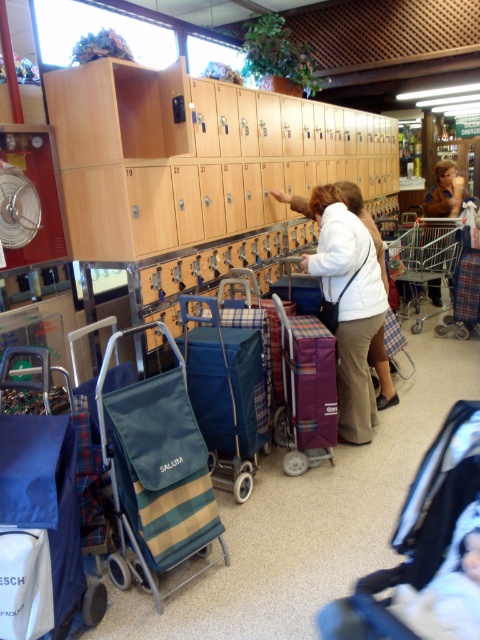
Can you confirm if dark blue fabric baby carriage at lower right is thinner than green striped fabric trolley at center?

Yes.

Is the position of dark blue fabric baby carriage at lower right more distant than that of green striped fabric trolley at center?

No.

Is point (393, 580) farther from camera compared to point (122, 566)?

No, it is in front of (122, 566).

The image size is (480, 640). In order to click on dark blue fabric baby carriage at lower right in this screenshot , I will do `click(427, 550)`.

Which is above, dark blue fabric baby carriage at lower right or brown plaid skirt at center?

brown plaid skirt at center is higher up.

Is point (448, 632) more distant than point (432, 280)?

No, (448, 632) is closer to viewer.

Which is in front, point (444, 560) or point (431, 280)?

Point (444, 560) is more forward.

Where is `dark blue fabric baby carriage at lower right`? The height and width of the screenshot is (640, 480). dark blue fabric baby carriage at lower right is located at coordinates (427, 550).

Can you confirm if dark blue fabric baby carriage at lower right is positioned above metallic silver trolley at center?

No, dark blue fabric baby carriage at lower right is not above metallic silver trolley at center.

Locate an element on the screen. The width and height of the screenshot is (480, 640). dark blue fabric baby carriage at lower right is located at coordinates (427, 550).